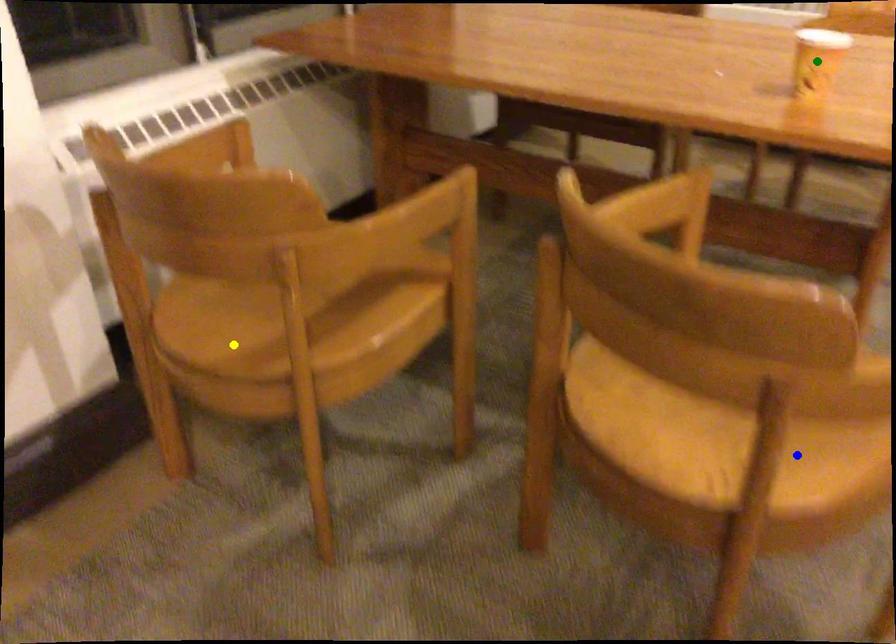
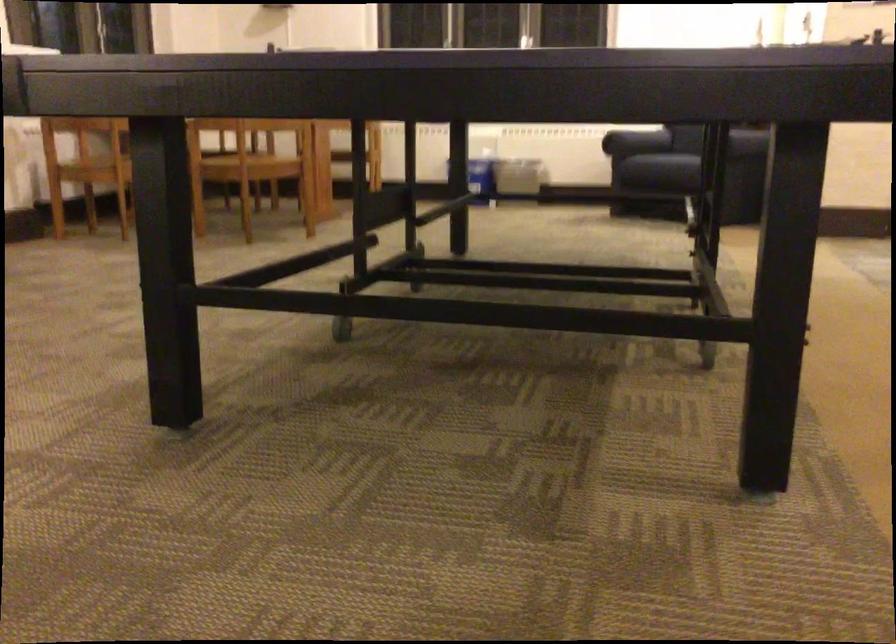
I am providing you with two images of the same scene from different viewpoints. Three points are marked in image1. Which point corresponds to a part or object that is occluded in image2?In image1, three points are marked. Which of them correspond to a part or object that is occluded in image2?Among the three points shown in image1, which one corresponds to a part or object that is no longer visible due to occlusion in image2?

green point